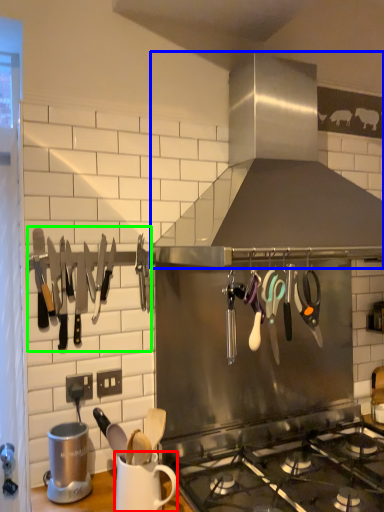
Question: Which object is positioned farthest from mug (highlighted by a red box)? Select from kitchen appliance (highlighted by a blue box) and cutlery (highlighted by a green box).

Choices:
 (A) kitchen appliance
 (B) cutlery

Answer: (A)